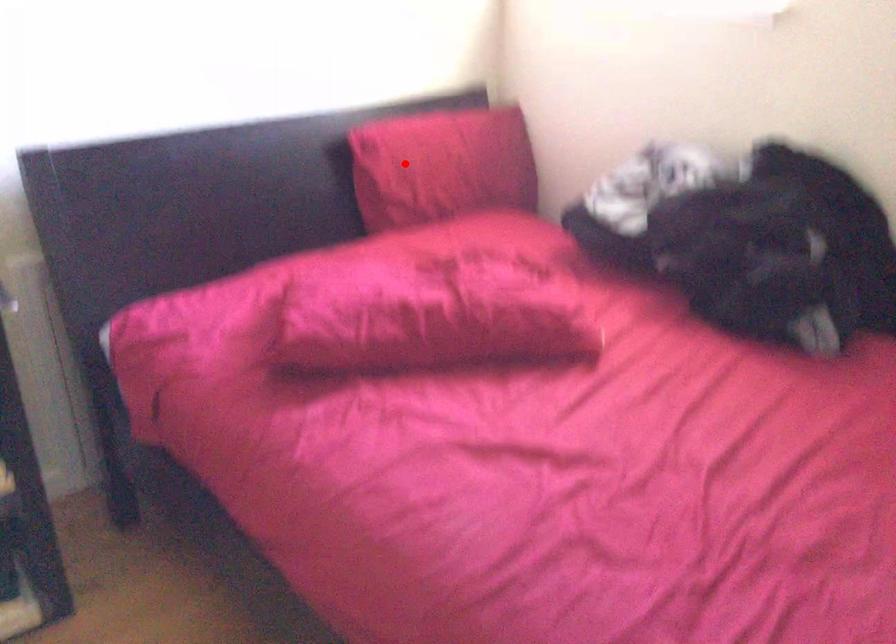
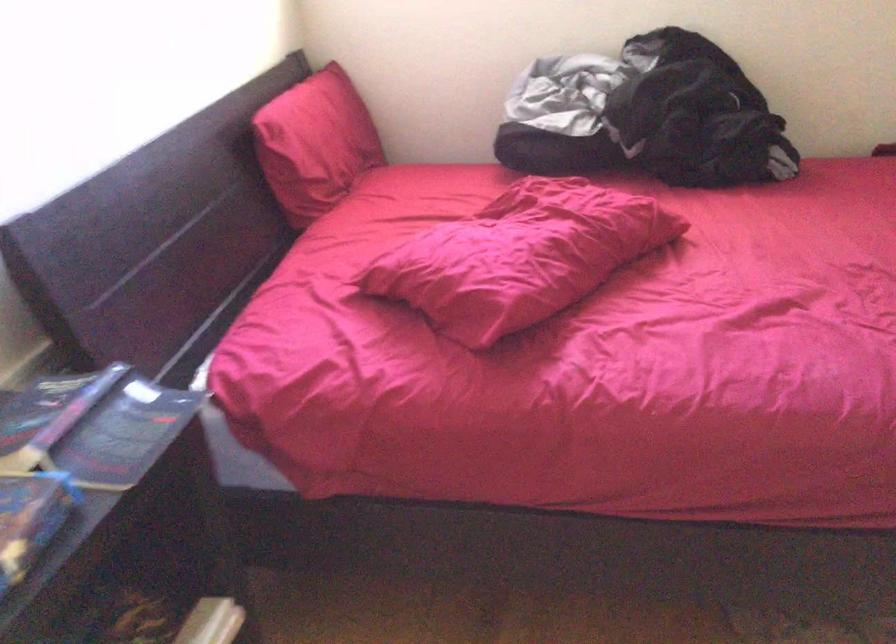
Where in the second image is the point corresponding to the highlighted location from the first image?

(314, 144)